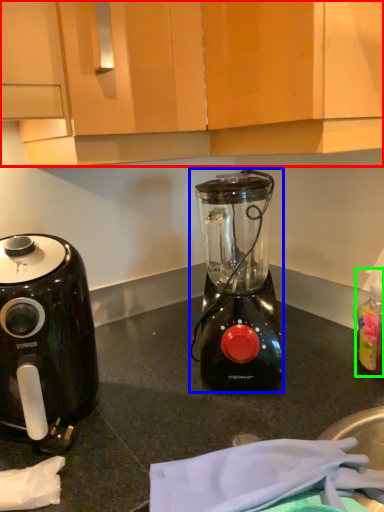
Question: Which object is the closest to the cabinetry (highlighted by a red box)? Choose among these: blender (highlighted by a blue box) or bottle (highlighted by a green box).

Choices:
 (A) blender
 (B) bottle

Answer: (A)